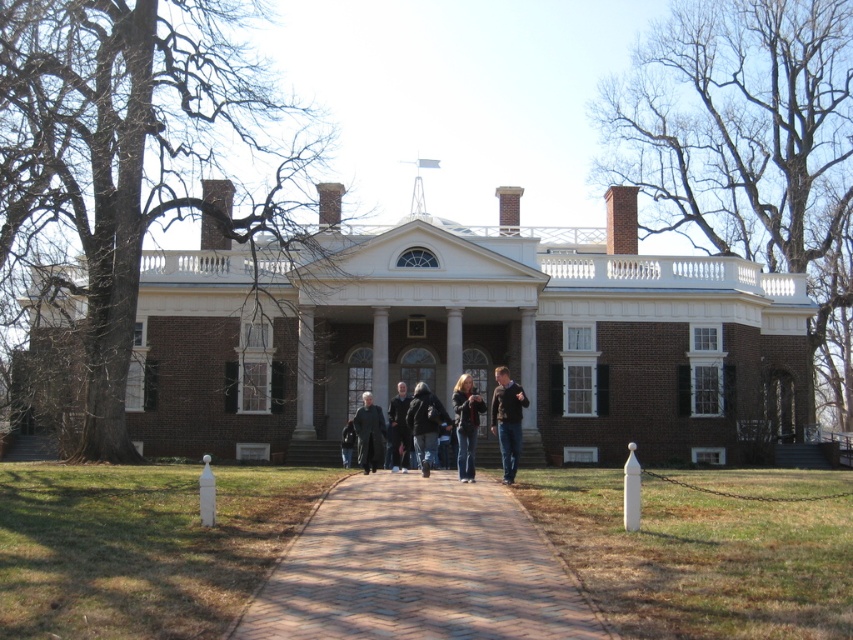
Question: Is brown brick building at center positioned at the back of dark brown leather jacket at center?

Choices:
 (A) yes
 (B) no

Answer: (A)

Question: Which object is positioned closest to the white glossy pillar at center?

Choices:
 (A) denim jacket at center
 (B) dark gray sweater at center

Answer: (A)

Question: Is denim jacket at center closer to the viewer compared to dark gray wool coat at center?

Choices:
 (A) no
 (B) yes

Answer: (B)

Question: Which point is farther to the camera?

Choices:
 (A) (463, 456)
 (B) (337, 339)
 (C) (419, 461)
 (D) (630, 499)

Answer: (B)

Question: In this image, where is dark brown leather jacket at center located relative to dark gray wool coat at center?

Choices:
 (A) right
 (B) left

Answer: (A)

Question: Which point is closer to the camera taking this photo?

Choices:
 (A) (346, 433)
 (B) (511, 468)

Answer: (B)